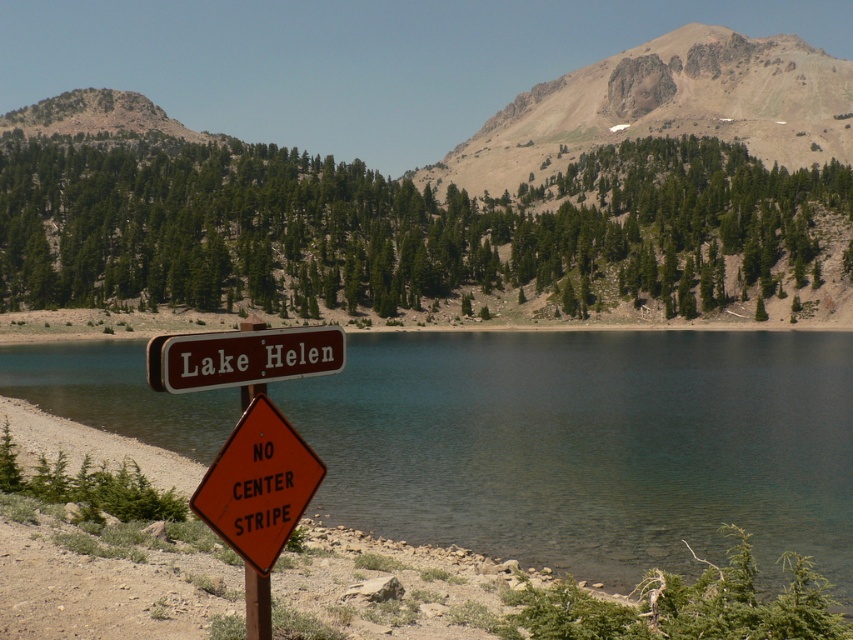
Question: Which object appears farthest from the camera in this image?

Choices:
 (A) clear water at lake center
 (B) orange diamond-shaped sign at lower center

Answer: (A)

Question: Observing the image, what is the correct spatial positioning of clear water at lake center in reference to brown wooden sign at center?

Choices:
 (A) above
 (B) below

Answer: (B)

Question: Can you confirm if brown wooden sign at center is positioned to the left of metallic pole at center?

Choices:
 (A) yes
 (B) no

Answer: (B)

Question: Which of the following is the farthest from the observer?

Choices:
 (A) brown wooden sign at center
 (B) orange diamond-shaped sign at lower center

Answer: (B)

Question: Which point is closer to the camera?

Choices:
 (A) brown wooden sign at center
 (B) clear water at lake center
 (C) metallic pole at center
 (D) brown rocky mountain at upper center

Answer: (A)

Question: Can you confirm if orange diamond-shaped sign at lower center is positioned above metallic pole at center?

Choices:
 (A) no
 (B) yes

Answer: (B)